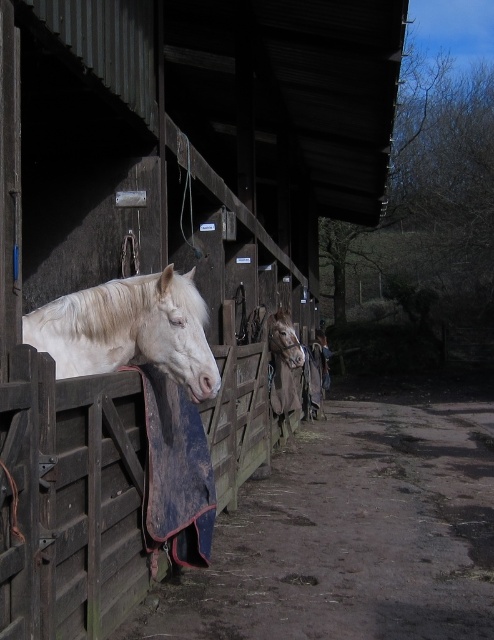
How far apart are wooden stable door at center and white matte horse at center?

A distance of 6.24 feet exists between wooden stable door at center and white matte horse at center.

The image size is (494, 640). I want to click on wooden stable door at center, so click(x=70, y=500).

You are a GUI agent. You are given a task and a screenshot of the screen. Output one action in this format:
    pyautogui.click(x=<x>, y=<y>)
    Task: Click on the wooden stable door at center
    The height and width of the screenshot is (640, 494).
    Given the screenshot: What is the action you would take?
    pyautogui.click(x=70, y=500)